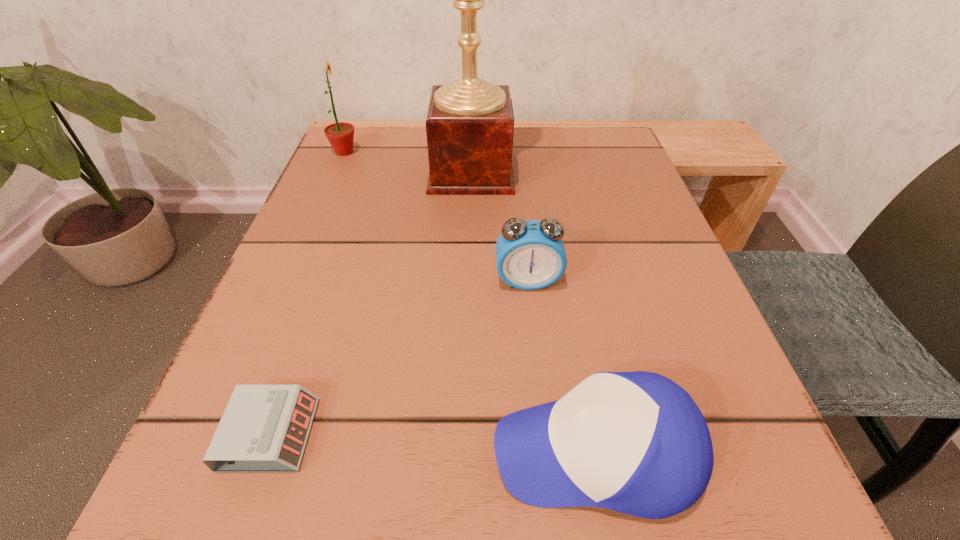
The image size is (960, 540). I want to click on blank region between the trophy cup and the sunflower, so click(408, 161).

The width and height of the screenshot is (960, 540). Identify the location of empty space that is in between the baseball cap and the second tallest object. (470, 302).

Find the location of a particular element. empty space between the second shortest object and the sunflower is located at coordinates [x=470, y=302].

Find the location of a particular element. The width and height of the screenshot is (960, 540). empty space between the second tallest object and the nearer alarm clock is located at coordinates (307, 293).

The image size is (960, 540). In order to click on vacant space that's between the right alarm clock and the nearer alarm clock in this screenshot , I will do `click(399, 357)`.

The image size is (960, 540). I want to click on unoccupied area between the tallest object and the second shortest object, so click(x=534, y=311).

Locate an element on the screen. unoccupied position between the shorter alarm clock and the baseball cap is located at coordinates (433, 442).

Where is `vacant point located between the nearer alarm clock and the tallest object`? The height and width of the screenshot is (540, 960). vacant point located between the nearer alarm clock and the tallest object is located at coordinates (371, 302).

Identify the location of blank region between the third shortest object and the shorter alarm clock. (399, 357).

Identify which object is located as the second nearest to the right alarm clock. Please provide its 2D coordinates. Your answer should be formatted as a tuple, i.e. [(x, y)], where the tuple contains the x and y coordinates of a point satisfying the conditions above.

[(635, 442)]